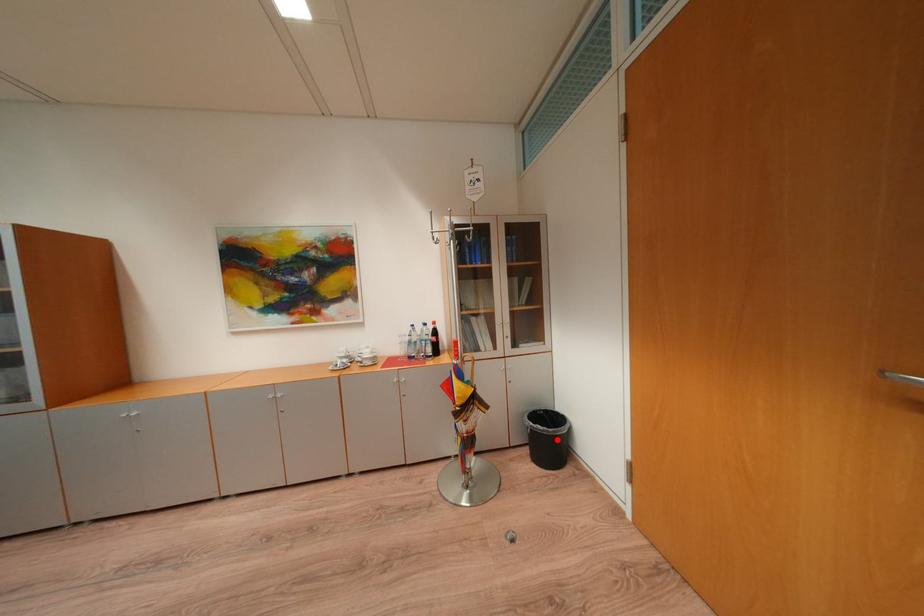
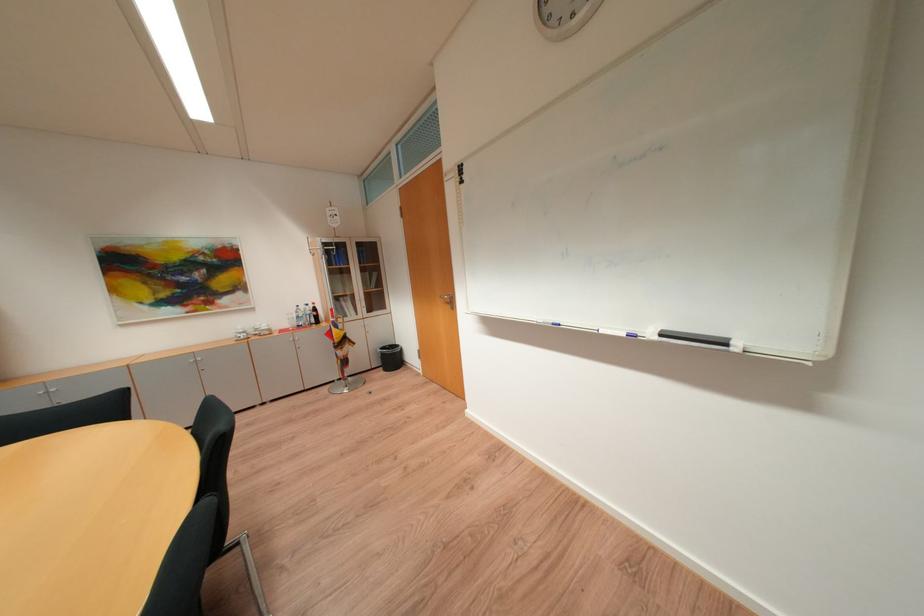
Where in the second image is the point corresponding to the highlighted location from the first image?

(400, 360)